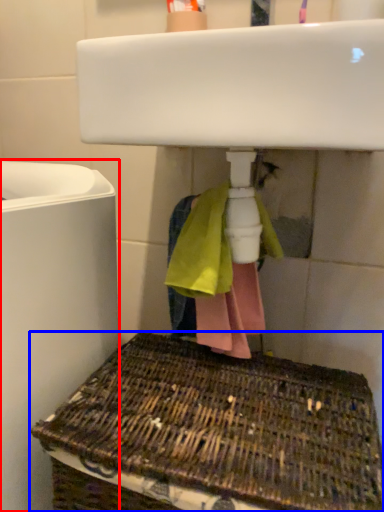
Question: Which object appears closest to the camera in this image, appliance (highlighted by a red box) or basket (highlighted by a blue box)?

Choices:
 (A) appliance
 (B) basket

Answer: (B)